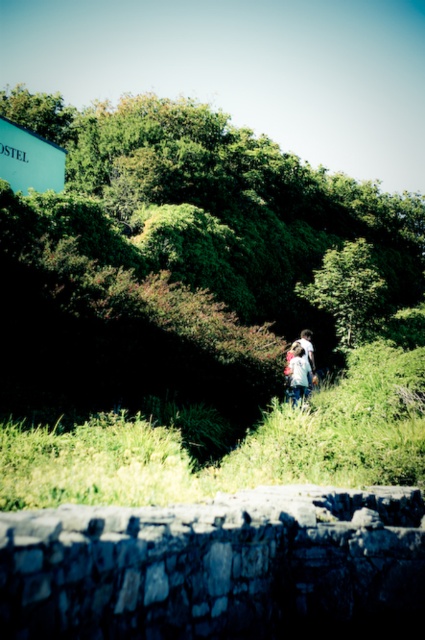
You are a photographer trying to capture a group photo of two people wearing a white matte jacket at center and a white cotton shirt at center. Since both are in the center, can you tell which one is more to the left?

The white matte jacket at center is positioned on the left side of white cotton shirt at center, so the white matte jacket at center is more to the left.

You are standing at the base of the stone wall and see the green painted signboard at upper left and the white matte jacket at center. You want to walk to the jacket first and then to the signboard. How many total feet will you walk?

The distance between the green painted signboard at upper left and the white matte jacket at center is 49.66 feet. Therefore, walking from the base of the stone wall to the jacket and then to the signboard would total 49.66 feet.